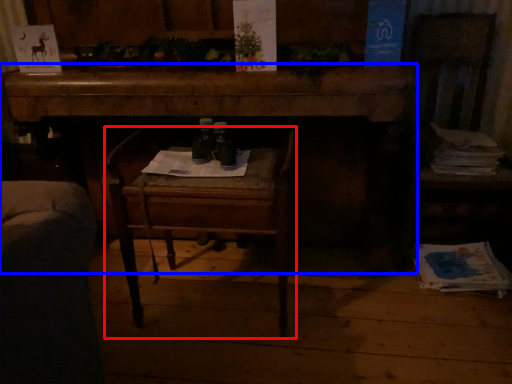
Question: Which of the following is the closest to the observer, chair (highlighted by a red box) or desk (highlighted by a blue box)?

Choices:
 (A) chair
 (B) desk

Answer: (A)